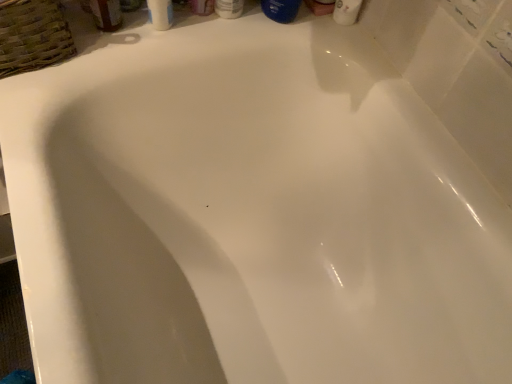
Question: Is blue glossy bottle at upper center, the second mouthwash in the left-to-right sequence, inside the boundaries of woven brown basket at upper left, or outside?

Choices:
 (A) inside
 (B) outside

Answer: (B)

Question: Looking at their shapes, would you say blue glossy bottle at upper center, placed as the first mouthwash when sorted from right to left, is wider or thinner than woven brown basket at upper left?

Choices:
 (A) wide
 (B) thin

Answer: (B)

Question: Which of these objects is positioned farthest from the white glossy bottle at upper center, the second toiletry from the left?

Choices:
 (A) matte plastic bottle at upper center, the second toiletry from the right
 (B) blue glossy bottle at upper center, the second mouthwash in the left-to-right sequence
 (C) translucent plastic mouthwash at upper left, the 1th mouthwash viewed from the left
 (D) woven brown basket at upper left

Answer: (D)

Question: Which object is positioned closest to the woven brown basket at upper left?

Choices:
 (A) translucent plastic mouthwash at upper left, the 1th mouthwash viewed from the left
 (B) blue glossy bottle at upper center, placed as the first mouthwash when sorted from right to left
 (C) white glossy bottle at upper center, the 1th toiletry in the right-to-left sequence
 (D) matte plastic bottle at upper center, the first toiletry when ordered from left to right

Answer: (A)